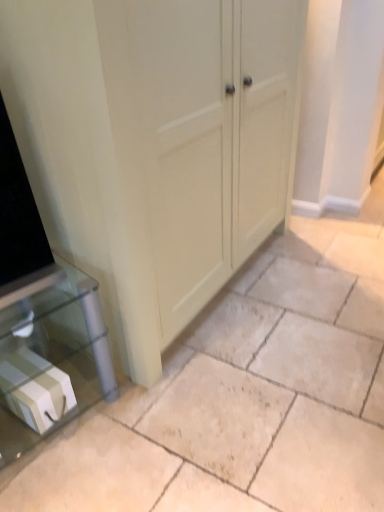
Question: Is matte cream cupboard at center aimed at white glossy box at lower left?

Choices:
 (A) yes
 (B) no

Answer: (B)

Question: Considering the relative sizes of matte cream cupboard at center and white glossy box at lower left in the image provided, is matte cream cupboard at center wider than white glossy box at lower left?

Choices:
 (A) yes
 (B) no

Answer: (B)

Question: Could white glossy box at lower left be considered to be inside matte cream cupboard at center?

Choices:
 (A) no
 (B) yes

Answer: (A)

Question: Is matte cream cupboard at center shorter than white glossy box at lower left?

Choices:
 (A) no
 (B) yes

Answer: (A)

Question: From the image's perspective, is matte cream cupboard at center on top of white glossy box at lower left?

Choices:
 (A) no
 (B) yes

Answer: (B)

Question: From the image's perspective, would you say matte cream cupboard at center is shown under white glossy box at lower left?

Choices:
 (A) no
 (B) yes

Answer: (A)

Question: Is beige tile floor at center surrounding matte cream cupboard at center?

Choices:
 (A) yes
 (B) no

Answer: (B)

Question: Does beige tile floor at center have a greater height compared to matte cream cupboard at center?

Choices:
 (A) no
 (B) yes

Answer: (A)

Question: Does beige tile floor at center have a greater width compared to matte cream cupboard at center?

Choices:
 (A) no
 (B) yes

Answer: (B)

Question: Is beige tile floor at center oriented towards matte cream cupboard at center?

Choices:
 (A) yes
 (B) no

Answer: (B)

Question: Is the depth of beige tile floor at center less than that of matte cream cupboard at center?

Choices:
 (A) no
 (B) yes

Answer: (B)

Question: Does beige tile floor at center have a smaller size compared to matte cream cupboard at center?

Choices:
 (A) no
 (B) yes

Answer: (B)

Question: Is beige tile floor at center not close to white glossy box at lower left?

Choices:
 (A) no
 (B) yes

Answer: (A)